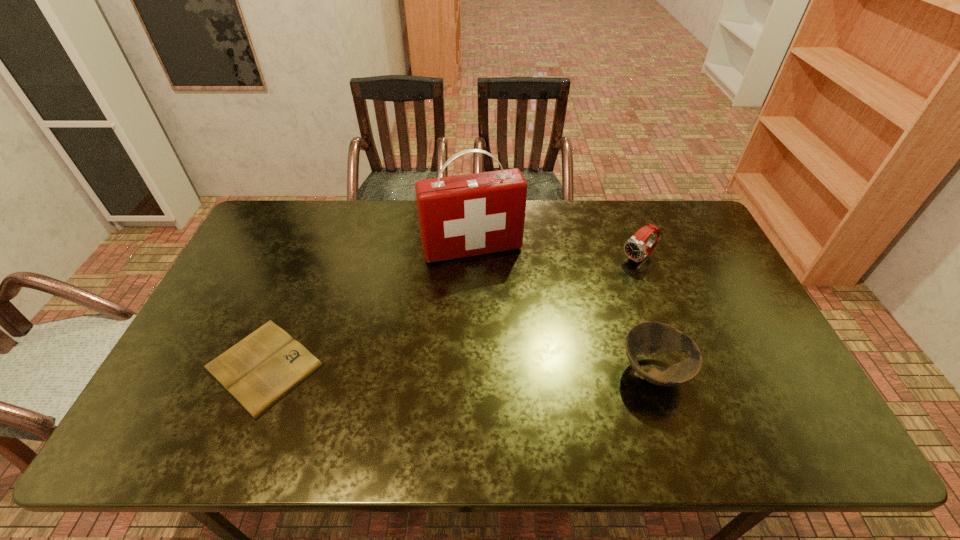
Find the location of a particular element. The image size is (960, 540). free space on the desktop that is between the book and the bowl and is positioned on the front face of the first-aid kit is located at coordinates (513, 369).

The width and height of the screenshot is (960, 540). What are the coordinates of `free space on the desktop that is between the book and the bowl and is positioned on the face of the second tallest object` in the screenshot? It's located at (473, 369).